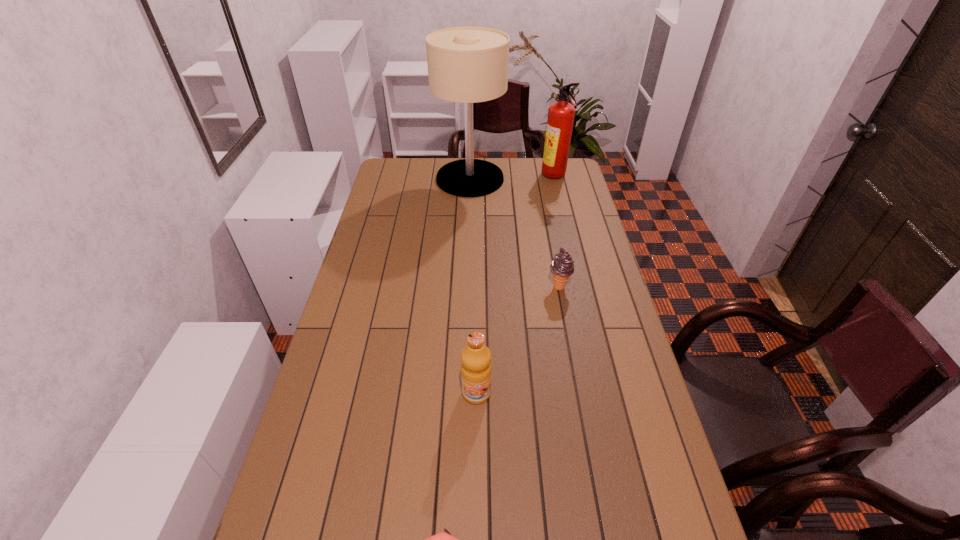
The height and width of the screenshot is (540, 960). I want to click on the tallest object, so click(x=467, y=65).

At what (x,y) coordinates should I click in order to perform the action: click on the second tallest object. Please return your answer as a coordinate pair (x, y). This screenshot has width=960, height=540. Looking at the image, I should click on (561, 114).

I want to click on fruit juice, so click(x=476, y=368).

The height and width of the screenshot is (540, 960). Identify the location of the second nearest object. (476, 368).

Find the location of a particular element. This screenshot has width=960, height=540. the fourth tallest object is located at coordinates (562, 267).

Locate an element on the screen. Image resolution: width=960 pixels, height=540 pixels. icecream is located at coordinates (562, 267).

This screenshot has height=540, width=960. I want to click on vacant area situated on the front of the tallest object, so click(468, 249).

Locate an element on the screen. vacant space situated on the front-facing side of the fire extinguisher is located at coordinates (519, 177).

Where is `vacant space situated on the front-facing side of the fire extinguisher`? The width and height of the screenshot is (960, 540). vacant space situated on the front-facing side of the fire extinguisher is located at coordinates (459, 177).

I want to click on vacant space situated 0.350m on the front-facing side of the fire extinguisher, so click(x=466, y=177).